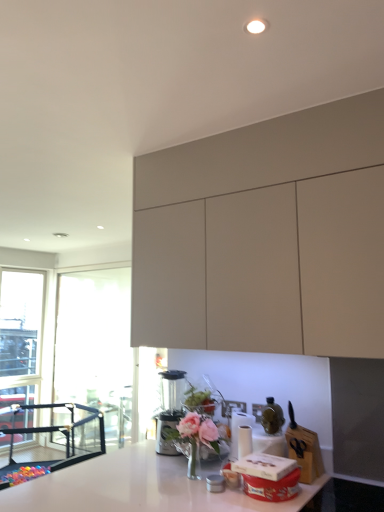
Question: Is satin silver blender at lower center oriented towards pink glass vase at center?

Choices:
 (A) no
 (B) yes

Answer: (A)

Question: From a real-world perspective, is satin silver blender at lower center below pink glass vase at center?

Choices:
 (A) yes
 (B) no

Answer: (B)

Question: Is satin silver blender at lower center to the left of pink glass vase at center from the viewer's perspective?

Choices:
 (A) yes
 (B) no

Answer: (A)

Question: Does satin silver blender at lower center come behind pink glass vase at center?

Choices:
 (A) yes
 (B) no

Answer: (A)

Question: Is satin silver blender at lower center at the right side of pink glass vase at center?

Choices:
 (A) no
 (B) yes

Answer: (A)

Question: Which is correct: pink glass vase at center is inside matte white cabinets at upper center, or outside of it?

Choices:
 (A) outside
 (B) inside

Answer: (A)

Question: From the image's perspective, is pink glass vase at center located above or below matte white cabinets at upper center?

Choices:
 (A) above
 (B) below

Answer: (B)

Question: Does point (190, 438) appear closer or farther from the camera than point (150, 310)?

Choices:
 (A) closer
 (B) farther

Answer: (A)

Question: Looking at the image, does pink glass vase at center seem bigger or smaller compared to matte white cabinets at upper center?

Choices:
 (A) big
 (B) small

Answer: (B)

Question: Is black mesh playpen at lower left to the left or to the right of satin silver blender at lower center in the image?

Choices:
 (A) right
 (B) left

Answer: (B)

Question: From a real-world perspective, is black mesh playpen at lower left physically located above or below satin silver blender at lower center?

Choices:
 (A) above
 (B) below

Answer: (B)

Question: Relative to satin silver blender at lower center, is black mesh playpen at lower left in front or behind?

Choices:
 (A) front
 (B) behind

Answer: (B)

Question: Is black mesh playpen at lower left situated inside satin silver blender at lower center or outside?

Choices:
 (A) outside
 (B) inside

Answer: (A)

Question: From a real-world perspective, relative to black mesh playpen at lower left, is pink glass vase at center vertically above or below?

Choices:
 (A) below
 (B) above

Answer: (B)

Question: In the image, is pink glass vase at center on the left side or the right side of black mesh playpen at lower left?

Choices:
 (A) left
 (B) right

Answer: (B)